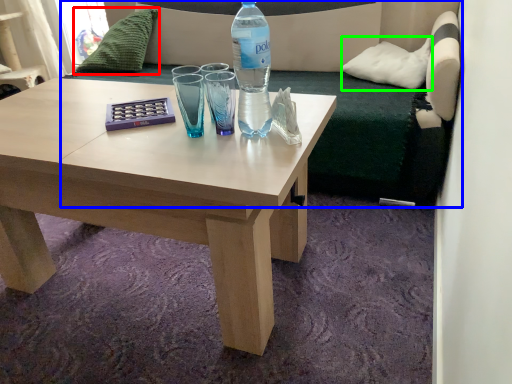
Question: Considering the real-world distances, which object is farthest from pillow (highlighted by a red box)? studio couch (highlighted by a blue box) or pillow (highlighted by a green box)?

Choices:
 (A) studio couch
 (B) pillow

Answer: (B)